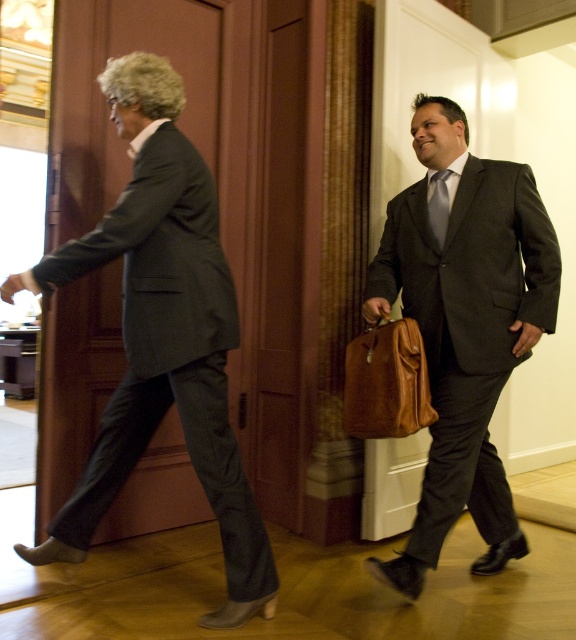
Question: Observing the image, what is the correct spatial positioning of matte black suit at right in reference to silky blue tie at center?

Choices:
 (A) left
 (B) right

Answer: (B)

Question: Can you confirm if matte black suit at right is smaller than silky blue tie at center?

Choices:
 (A) yes
 (B) no

Answer: (B)

Question: Which object appears farthest from the camera in this image?

Choices:
 (A) matte black suit at right
 (B) matte black suit at left

Answer: (A)

Question: Which object appears farthest from the camera in this image?

Choices:
 (A) brown leather briefcase at center
 (B) matte black suit at right
 (C) silky blue tie at center
 (D) matte black suit at left

Answer: (C)

Question: Can you confirm if matte black suit at left is positioned below matte black suit at right?

Choices:
 (A) no
 (B) yes

Answer: (B)

Question: Among these points, which one is farthest from the camera?

Choices:
 (A) (439, 444)
 (B) (233, 444)
 (C) (433, 228)

Answer: (C)